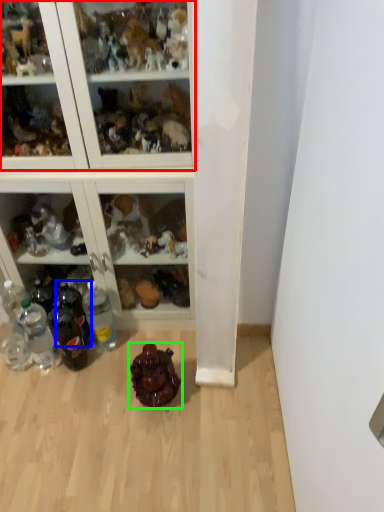
Question: Estimate the real-world distances between objects in this image. Which object is closer to shelf (highlighted by a red box), bottle (highlighted by a blue box) or toy (highlighted by a green box)?

Choices:
 (A) bottle
 (B) toy

Answer: (A)